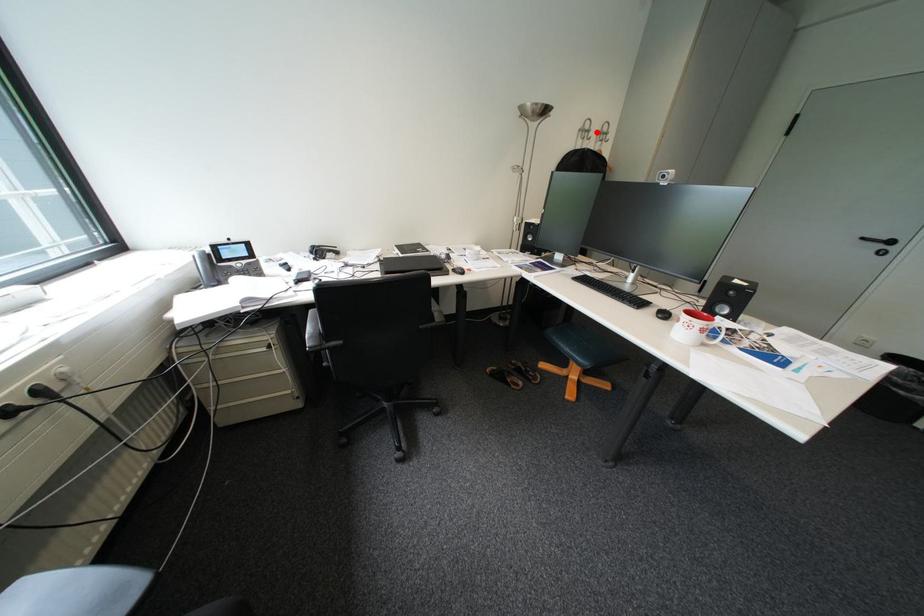
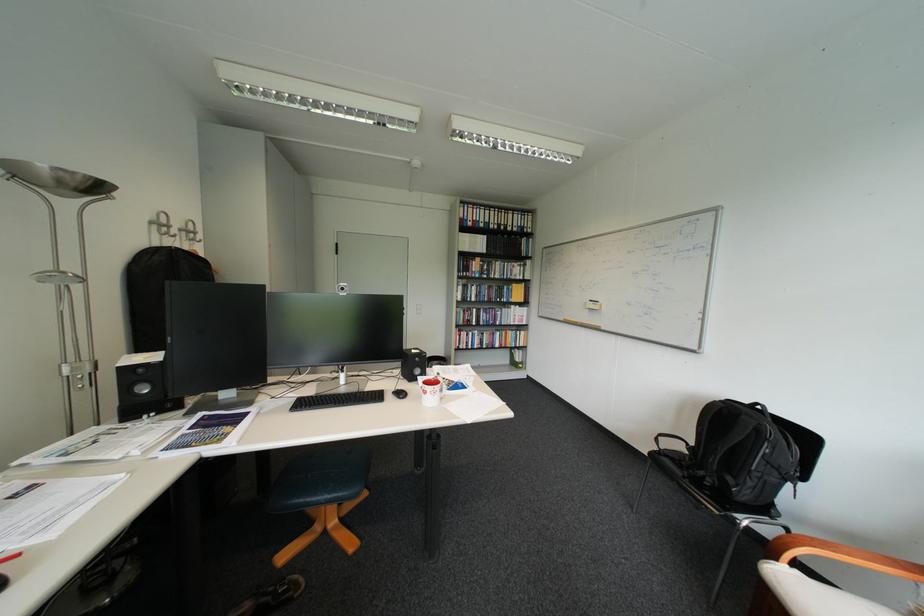
Question: I am providing you with two images of the same scene from different viewpoints. In image1, a red point is highlighted. Considering the same 3D point in image2, which of the following is correct?

Choices:
 (A) It is closer
 (B) It is farther

Answer: (B)